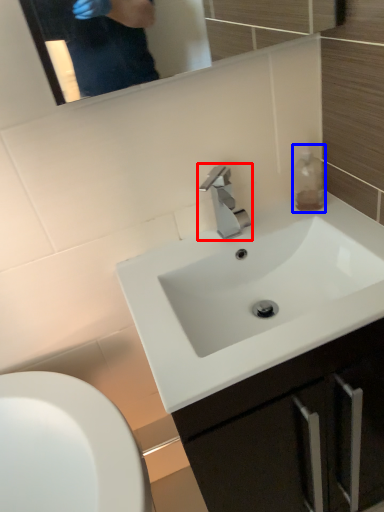
Question: Which object is closer to the camera taking this photo, tap (highlighted by a red box) or bottle (highlighted by a blue box)?

Choices:
 (A) tap
 (B) bottle

Answer: (A)